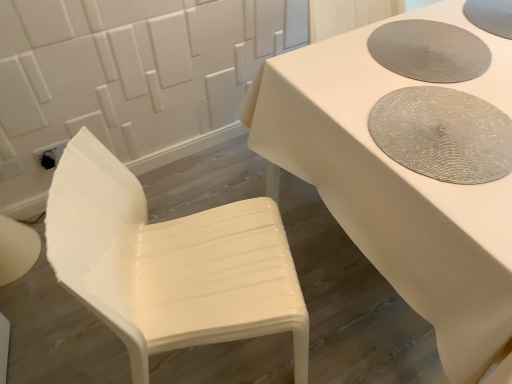
Locate an element on the screen. The width and height of the screenshot is (512, 384). white glossy table at center is located at coordinates (393, 175).

The image size is (512, 384). Identify the location of textured gray mat at upper right, which appears as the 1th manhole cover when ordered from the bottom. (443, 134).

Image resolution: width=512 pixels, height=384 pixels. Find the location of `gray woven placemat at upper right, marked as the first manhole cover in a top-to-bottom arrangement`. gray woven placemat at upper right, marked as the first manhole cover in a top-to-bottom arrangement is located at coordinates (490, 16).

How much space does textured gray placemat at upper right, which ranks as the second manhole cover in top-to-bottom order, occupy horizontally?

The width of textured gray placemat at upper right, which ranks as the second manhole cover in top-to-bottom order, is 13.64 inches.

This screenshot has width=512, height=384. I want to click on white glossy table at center, so click(393, 175).

Is white glossy chair at left positioned with its back to textured gray placemat at upper right, which ranks as the second manhole cover in top-to-bottom order?

No, white glossy chair at left is not facing away from textured gray placemat at upper right, which ranks as the second manhole cover in top-to-bottom order.

Which object is more forward, white glossy chair at left or textured gray placemat at upper right, the second manhole cover positioned from the bottom?

white glossy chair at left is closer to the camera.

Identify the location of the 2nd manhole cover counting from the right side of the white glossy chair at left. (429, 51).

In the scene shown: Is white glossy chair at left at the right side of textured gray placemat at upper right, which ranks as the second manhole cover in top-to-bottom order?

Incorrect, white glossy chair at left is not on the right side of textured gray placemat at upper right, which ranks as the second manhole cover in top-to-bottom order.

Is textured gray mat at upper right, which is the 3th manhole cover in top-to-bottom order, smaller than textured gray placemat at upper right, which ranks as the second manhole cover in top-to-bottom order?

Yes, textured gray mat at upper right, which is the 3th manhole cover in top-to-bottom order, is smaller than textured gray placemat at upper right, which ranks as the second manhole cover in top-to-bottom order.

Which is less distant, (426, 106) or (408, 72)?

Positioned in front is point (426, 106).

From a real-world perspective, between textured gray mat at upper right, which is the 3th manhole cover in top-to-bottom order, and textured gray placemat at upper right, which ranks as the second manhole cover in top-to-bottom order, who is vertically higher?

From a 3D spatial view, textured gray placemat at upper right, which ranks as the second manhole cover in top-to-bottom order, is above.

Which object is closer to the camera, textured gray mat at upper right, which appears as the 1th manhole cover when ordered from the bottom, or textured gray placemat at upper right, which ranks as the second manhole cover in top-to-bottom order?

textured gray mat at upper right, which appears as the 1th manhole cover when ordered from the bottom, is more forward.

Looking at this image, is the position of white glossy chair at left more distant than that of textured gray mat at upper right, which appears as the 1th manhole cover when ordered from the bottom?

No, it is in front of textured gray mat at upper right, which appears as the 1th manhole cover when ordered from the bottom.

From a real-world perspective, starting from the white glossy chair at left, which manhole cover is the 1st one vertically above it? Please provide its 2D coordinates.

[(443, 134)]

How many degrees apart are the facing directions of white glossy chair at left and textured gray mat at upper right, which appears as the 1th manhole cover when ordered from the bottom?

162 degrees separate the facing orientations of white glossy chair at left and textured gray mat at upper right, which appears as the 1th manhole cover when ordered from the bottom.

Could you measure the distance between white glossy chair at left and textured gray mat at upper right, which appears as the 1th manhole cover when ordered from the bottom?

white glossy chair at left and textured gray mat at upper right, which appears as the 1th manhole cover when ordered from the bottom, are 22.03 inches apart.

Is white glossy table at center aimed at white glossy chair at left?

No, white glossy table at center is not turned towards white glossy chair at left.

Which is correct: white glossy table at center is inside white glossy chair at left, or outside of it?

white glossy table at center is located beyond the bounds of white glossy chair at left.

Looking at this image, how much distance is there between white glossy table at center and white glossy chair at left?

white glossy table at center is 16.75 inches away from white glossy chair at left.

Considering their positions, is white glossy table at center located in front of or behind white glossy chair at left?

white glossy table at center is in front of white glossy chair at left.

Who is bigger, white glossy table at center or gray woven placemat at upper right, marked as the first manhole cover in a top-to-bottom arrangement?

white glossy table at center is bigger.

Identify the location of the 2nd manhole cover above the white glossy table at center (from the image's perspective). (490, 16).

Does white glossy table at center appear on the right side of gray woven placemat at upper right, positioned as the 3th manhole cover in bottom-to-top order?

Correct, you'll find white glossy table at center to the right of gray woven placemat at upper right, positioned as the 3th manhole cover in bottom-to-top order.

From a real-world perspective, which is physically below, textured gray mat at upper right, which is the 3th manhole cover in top-to-bottom order, or white glossy chair at left?

white glossy chair at left is physically lower.

From the image's perspective, is textured gray mat at upper right, which is the 3th manhole cover in top-to-bottom order, below white glossy chair at left?

No, from the image's perspective, textured gray mat at upper right, which is the 3th manhole cover in top-to-bottom order, is not below white glossy chair at left.

Is textured gray mat at upper right, which appears as the 1th manhole cover when ordered from the bottom, aimed at white glossy chair at left?

Yes, textured gray mat at upper right, which appears as the 1th manhole cover when ordered from the bottom, is aimed at white glossy chair at left.

Looking at this image, which is less distant, (384,144) or (106,264)?

The point (106,264) is closer to the camera.

Is textured gray placemat at upper right, the second manhole cover positioned from the bottom, turned away from white glossy table at center?

Yes, white glossy table at center is at the back of textured gray placemat at upper right, the second manhole cover positioned from the bottom.

Can you confirm if textured gray placemat at upper right, the second manhole cover positioned from the bottom, is smaller than white glossy table at center?

Indeed, textured gray placemat at upper right, the second manhole cover positioned from the bottom, has a smaller size compared to white glossy table at center.

From a real-world perspective, which is physically below, textured gray placemat at upper right, the second manhole cover positioned from the bottom, or white glossy table at center?

white glossy table at center.

Considering the relative sizes of textured gray placemat at upper right, which ranks as the second manhole cover in top-to-bottom order, and white glossy table at center in the image provided, is textured gray placemat at upper right, which ranks as the second manhole cover in top-to-bottom order, shorter than white glossy table at center?

Yes, textured gray placemat at upper right, which ranks as the second manhole cover in top-to-bottom order, is shorter than white glossy table at center.

This screenshot has height=384, width=512. I want to click on chair below the textured gray placemat at upper right, the second manhole cover positioned from the bottom (from the image's perspective), so click(x=169, y=263).

I want to click on manhole cover that appears below the textured gray placemat at upper right, the second manhole cover positioned from the bottom (from a real-world perspective), so click(x=443, y=134).

When comparing their distances from textured gray placemat at upper right, the second manhole cover positioned from the bottom, does white glossy chair at left or white glossy table at center seem closer?

Based on the image, white glossy table at center appears to be nearer to textured gray placemat at upper right, the second manhole cover positioned from the bottom.

Which object lies further to the anchor point white glossy chair at left, textured gray placemat at upper right, which ranks as the second manhole cover in top-to-bottom order, or white glossy table at center?

textured gray placemat at upper right, which ranks as the second manhole cover in top-to-bottom order, is positioned further to the anchor white glossy chair at left.

In the scene shown: Considering their positions, is white glossy table at center positioned further to white glossy chair at left than textured gray placemat at upper right, the second manhole cover positioned from the bottom?

The object further to white glossy chair at left is textured gray placemat at upper right, the second manhole cover positioned from the bottom.

Which object lies nearer to the anchor point textured gray mat at upper right, which appears as the 1th manhole cover when ordered from the bottom, white glossy table at center or gray woven placemat at upper right, positioned as the 3th manhole cover in bottom-to-top order?

white glossy table at center is positioned closer to the anchor textured gray mat at upper right, which appears as the 1th manhole cover when ordered from the bottom.

Looking at the image, which one is located closer to white glossy chair at left, textured gray mat at upper right, which is the 3th manhole cover in top-to-bottom order, or textured gray placemat at upper right, which ranks as the second manhole cover in top-to-bottom order?

Among the two, textured gray mat at upper right, which is the 3th manhole cover in top-to-bottom order, is located nearer to white glossy chair at left.

Considering their positions, is textured gray placemat at upper right, the second manhole cover positioned from the bottom, positioned closer to textured gray mat at upper right, which is the 3th manhole cover in top-to-bottom order, than white glossy chair at left?

Based on the image, textured gray placemat at upper right, the second manhole cover positioned from the bottom, appears to be nearer to textured gray mat at upper right, which is the 3th manhole cover in top-to-bottom order.

When comparing their distances from gray woven placemat at upper right, marked as the first manhole cover in a top-to-bottom arrangement, does white glossy chair at left or textured gray placemat at upper right, which ranks as the second manhole cover in top-to-bottom order, seem closer?

Among the two, textured gray placemat at upper right, which ranks as the second manhole cover in top-to-bottom order, is located nearer to gray woven placemat at upper right, marked as the first manhole cover in a top-to-bottom arrangement.

When comparing their distances from gray woven placemat at upper right, marked as the first manhole cover in a top-to-bottom arrangement, does textured gray placemat at upper right, which ranks as the second manhole cover in top-to-bottom order, or textured gray mat at upper right, which appears as the 1th manhole cover when ordered from the bottom, seem further?

textured gray mat at upper right, which appears as the 1th manhole cover when ordered from the bottom, lies further to gray woven placemat at upper right, marked as the first manhole cover in a top-to-bottom arrangement, than the other object.

Image resolution: width=512 pixels, height=384 pixels. What are the coordinates of `manhole cover located between textured gray mat at upper right, which is the 3th manhole cover in top-to-bottom order, and gray woven placemat at upper right, positioned as the 3th manhole cover in bottom-to-top order, in the left-right direction` in the screenshot? It's located at (429, 51).

You are a GUI agent. You are given a task and a screenshot of the screen. Output one action in this format:
    pyautogui.click(x=<x>, y=<y>)
    Task: Click on the manhole cover located between white glossy chair at left and textured gray placemat at upper right, which ranks as the second manhole cover in top-to-bottom order, in the left-right direction
    The width and height of the screenshot is (512, 384).
    Given the screenshot: What is the action you would take?
    pyautogui.click(x=443, y=134)